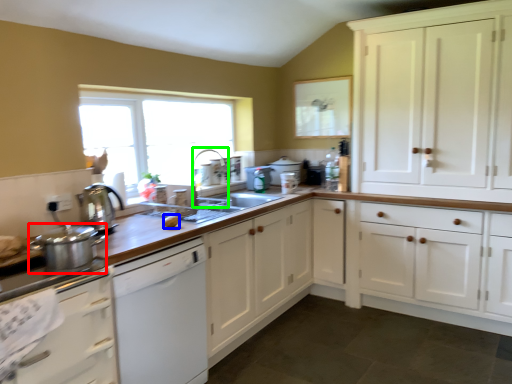
Question: Estimate the real-world distances between objects in this image. Which object is closer to kitchen appliance (highlighted by a red box), food (highlighted by a blue box) or faucet (highlighted by a green box)?

Choices:
 (A) food
 (B) faucet

Answer: (A)